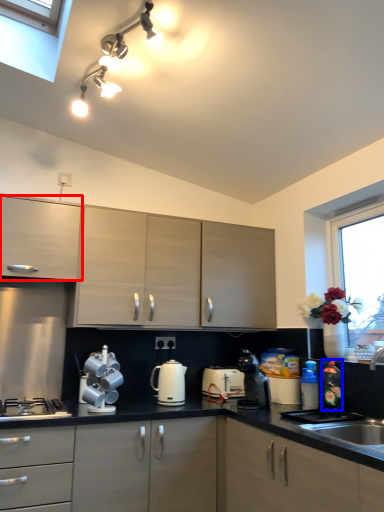
Question: Which object is closer to the camera taking this photo, cabinetry (highlighted by a red box) or bottle (highlighted by a blue box)?

Choices:
 (A) cabinetry
 (B) bottle

Answer: (A)